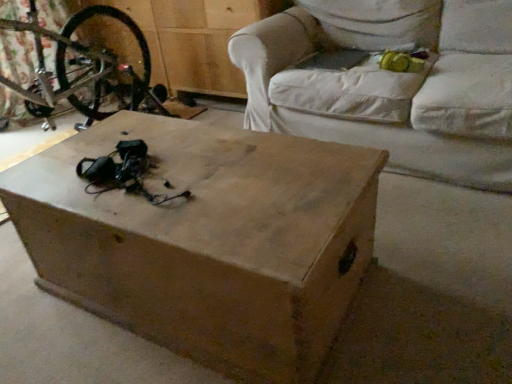
What do you see at coordinates (390, 83) in the screenshot? I see `white fabric couch at center` at bounding box center [390, 83].

Find the location of a particular element. The image size is (512, 384). white fabric couch at center is located at coordinates (390, 83).

What is the approximate height of brown matte wooden box at center?

It is 17.53 inches.

Describe the element at coordinates (208, 241) in the screenshot. I see `brown matte wooden box at center` at that location.

Find the location of a particular element. Image resolution: width=512 pixels, height=384 pixels. brown matte wooden box at center is located at coordinates (208, 241).

Locate an element on the screen. The height and width of the screenshot is (384, 512). white fabric couch at center is located at coordinates (390, 83).

Which is more to the left, brown matte wooden box at center or white fabric couch at center?

brown matte wooden box at center.

In the scene shown: Is brown matte wooden box at center positioned behind white fabric couch at center?

No, it is in front of white fabric couch at center.

Is point (184, 224) closer or farther from the camera than point (382, 121)?

Clearly, point (184, 224) is closer to the camera than point (382, 121).

From the image's perspective, is brown matte wooden box at center located beneath white fabric couch at center?

Yes, from the image's perspective, brown matte wooden box at center is below white fabric couch at center.

From a real-world perspective, is brown matte wooden box at center under white fabric couch at center?

Yes, from a real-world perspective, brown matte wooden box at center is under white fabric couch at center.

Which of these two, brown matte wooden box at center or white fabric couch at center, is thinner?

brown matte wooden box at center is thinner.

Does brown matte wooden box at center have a lesser height compared to white fabric couch at center?

Yes.

Who is bigger, brown matte wooden box at center or white fabric couch at center?

white fabric couch at center.

Is brown matte wooden box at center situated inside white fabric couch at center or outside?

brown matte wooden box at center is located beyond the bounds of white fabric couch at center.

Is brown matte wooden box at center next to white fabric couch at center and touching it?

There is a gap between brown matte wooden box at center and white fabric couch at center.

Is white fabric couch at center at the back of brown matte wooden box at center?

That's right, brown matte wooden box at center is facing away from white fabric couch at center.

How far apart are brown matte wooden box at center and white fabric couch at center?

brown matte wooden box at center and white fabric couch at center are 37.19 inches apart.

Locate an element on the screen. table below the white fabric couch at center (from a real-world perspective) is located at coordinates (208, 241).

In the image, is white fabric couch at center on the left side or the right side of brown matte wooden box at center?

white fabric couch at center is positioned on brown matte wooden box at center's right side.

Which object is further away from the camera taking this photo, white fabric couch at center or brown matte wooden box at center?

Positioned behind is white fabric couch at center.

Is point (439, 39) less distant than point (309, 373)?

No, (439, 39) is behind (309, 373).

From the image's perspective, between white fabric couch at center and brown matte wooden box at center, who is located below?

brown matte wooden box at center is shown below in the image.

From a real-world perspective, is white fabric couch at center physically located above or below brown matte wooden box at center?

white fabric couch at center is situated higher than brown matte wooden box at center in the real world.

Considering the relative sizes of white fabric couch at center and brown matte wooden box at center in the image provided, is white fabric couch at center wider than brown matte wooden box at center?

Indeed, white fabric couch at center has a greater width compared to brown matte wooden box at center.

In terms of height, does white fabric couch at center look taller or shorter compared to brown matte wooden box at center?

Clearly, white fabric couch at center is taller compared to brown matte wooden box at center.

Who is bigger, white fabric couch at center or brown matte wooden box at center?

white fabric couch at center.

Looking at this image, would you say white fabric couch at center contains brown matte wooden box at center?

No, brown matte wooden box at center is located outside of white fabric couch at center.

Are white fabric couch at center and brown matte wooden box at center far apart?

white fabric couch at center is near brown matte wooden box at center, not far away.

Is white fabric couch at center oriented away from brown matte wooden box at center?

No, brown matte wooden box at center is not at the back of white fabric couch at center.

The width and height of the screenshot is (512, 384). In the image, there is a brown matte wooden box at center. Identify the location of studio couch above it (from the image's perspective). (390, 83).

In order to click on studio couch that is on the right side of brown matte wooden box at center in this screenshot , I will do coord(390,83).

Locate an element on the screen. table located in front of the white fabric couch at center is located at coordinates (208, 241).